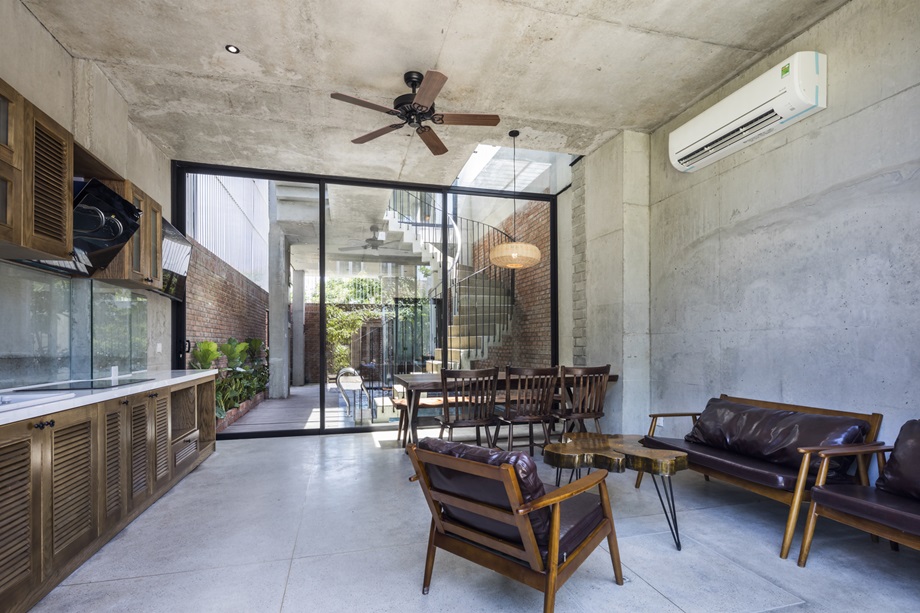
I want to click on metal of ceiling fan, so click(x=400, y=107), click(x=412, y=121).